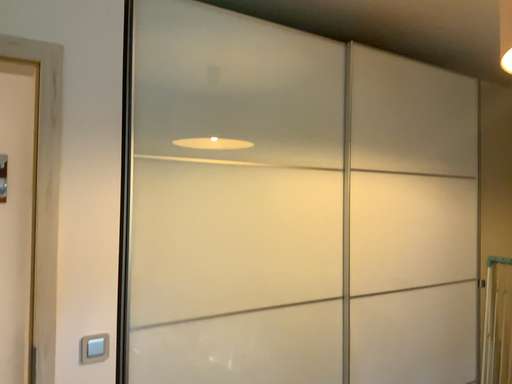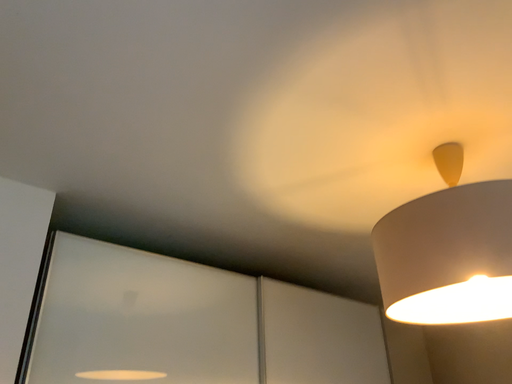
Question: How did the camera likely rotate when shooting the video?

Choices:
 (A) rotated right
 (B) rotated left

Answer: (A)